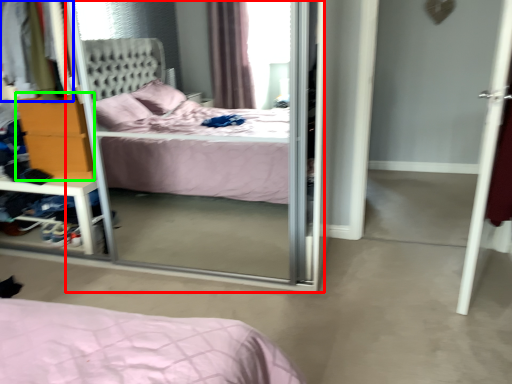
Question: Which is farther away from screen door (highlighted by a red box)? clothing (highlighted by a blue box) or dresser (highlighted by a green box)?

Choices:
 (A) clothing
 (B) dresser

Answer: (A)